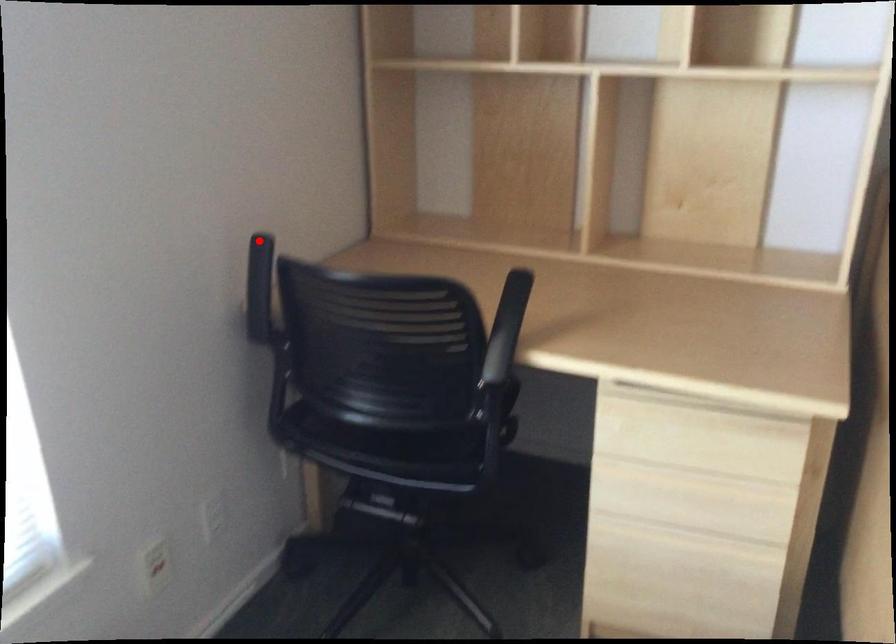
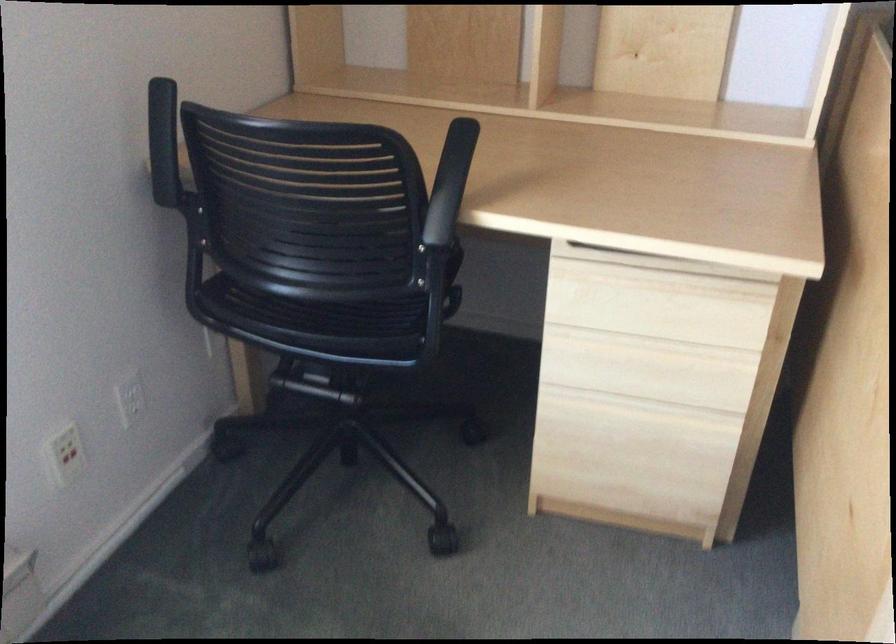
In the second image, find the point that corresponds to the highlighted location in the first image.

(162, 88)